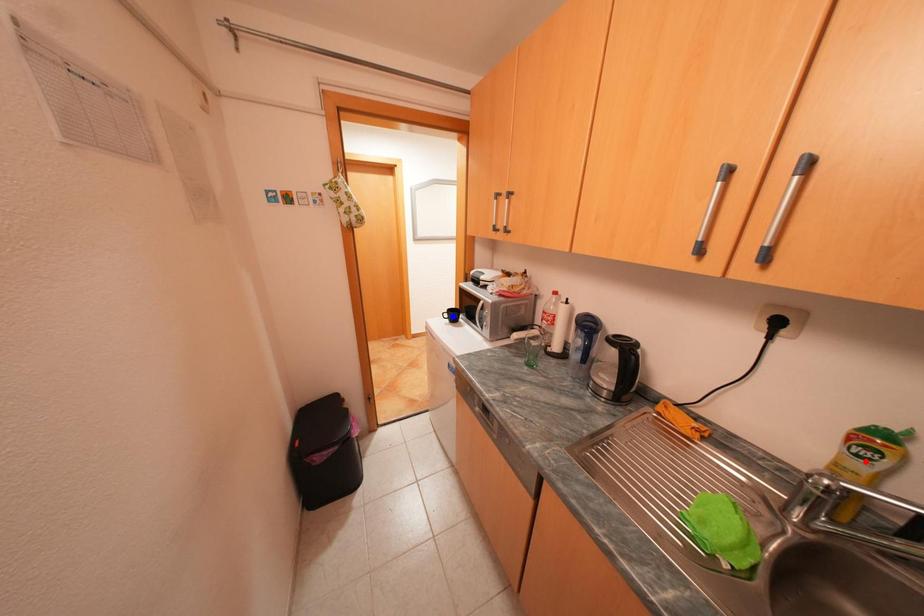
Question: Two points are marked on the image. Which point is closer to the camera?

Choices:
 (A) Blue point is closer.
 (B) Red point is closer.

Answer: (B)